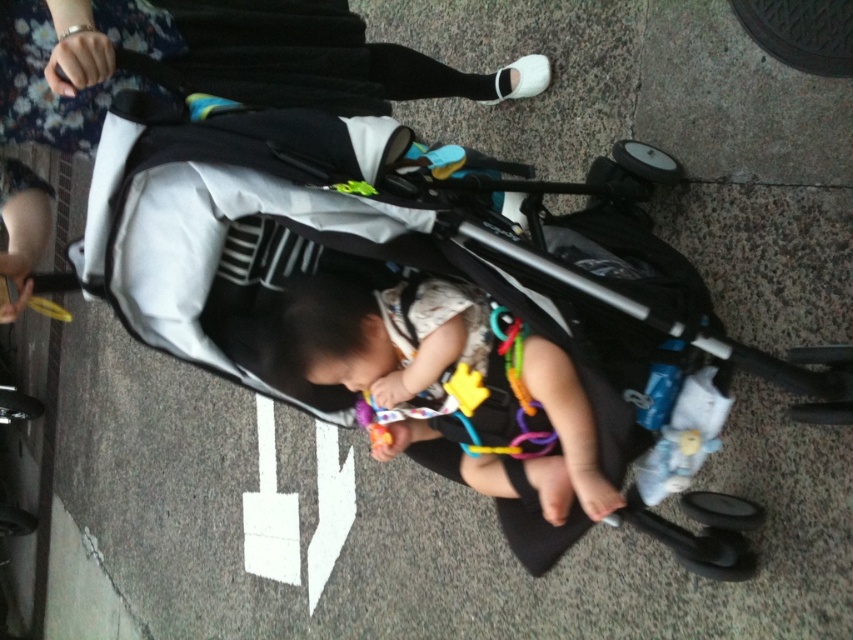
What are the coordinates of `black fabric baby carriage at center` in the screenshot? It's located at (405, 275).

Is point (735, 545) less distant than point (242, 36)?

No, (735, 545) is further to viewer.

Between point (259, 241) and point (4, 316), which one is positioned behind?

The point (259, 241) is more distant.

Image resolution: width=853 pixels, height=640 pixels. Find the location of `black fabric baby carriage at center`. black fabric baby carriage at center is located at coordinates (405, 275).

Locate an element on the screen. white fabric stroller at center is located at coordinates (215, 61).

The width and height of the screenshot is (853, 640). I want to click on white fabric stroller at center, so click(x=215, y=61).

Can you confirm if black fabric baby carriage at center is positioned to the left of soft white fabric baby at center?

Incorrect, black fabric baby carriage at center is not on the left side of soft white fabric baby at center.

Which is below, black fabric baby carriage at center or soft white fabric baby at center?

soft white fabric baby at center is lower down.

Is point (611, 348) positioned in front of point (479, 326)?

No, it is behind (479, 326).

The image size is (853, 640). I want to click on black fabric baby carriage at center, so click(405, 275).